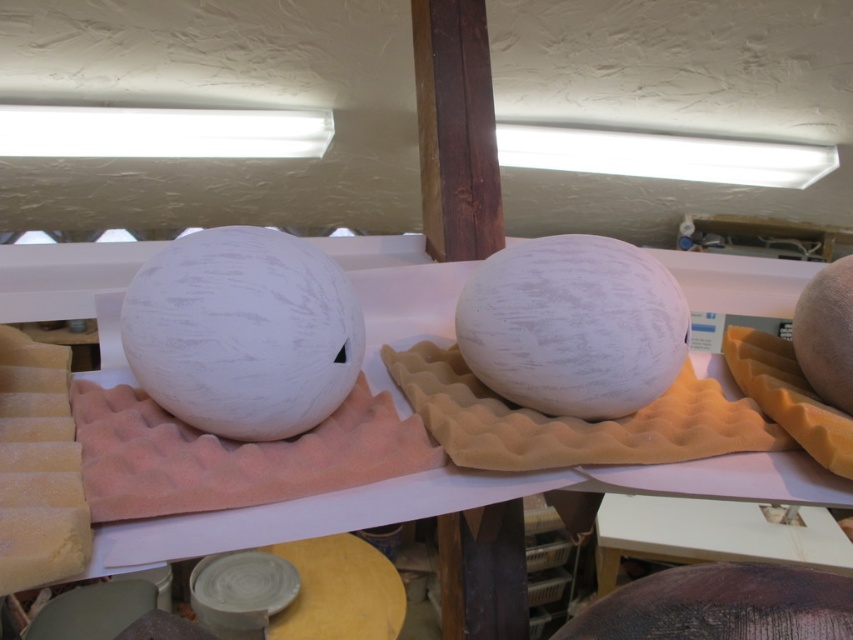
Can you confirm if white matte sphere at center is smaller than smooth beige melon at right?

Actually, white matte sphere at center might be larger than smooth beige melon at right.

Between white matte sphere at center and smooth beige melon at right, which one appears on the left side from the viewer's perspective?

Positioned to the left is white matte sphere at center.

Does point (779, 461) come behind point (839, 266)?

No, (779, 461) is closer to viewer.

Locate an element on the screen. The image size is (853, 640). white matte sphere at center is located at coordinates (459, 502).

Who is positioned more to the left, white matte sphere at center or white textured melon at left?

white textured melon at left

In the scene shown: Is white matte sphere at center bigger than white textured melon at left?

Correct, white matte sphere at center is larger in size than white textured melon at left.

The height and width of the screenshot is (640, 853). What do you see at coordinates (459, 502) in the screenshot? I see `white matte sphere at center` at bounding box center [459, 502].

Identify the location of white matte sphere at center. (459, 502).

Does white textured melon at left have a larger size compared to white matte melon at center?

Actually, white textured melon at left might be smaller than white matte melon at center.

Can you confirm if white textured melon at left is positioned to the left of white matte melon at center?

Indeed, white textured melon at left is positioned on the left side of white matte melon at center.

Which is behind, point (126, 323) or point (579, 246)?

The point (579, 246) is more distant.

Locate an element on the screen. The height and width of the screenshot is (640, 853). white textured melon at left is located at coordinates (242, 332).